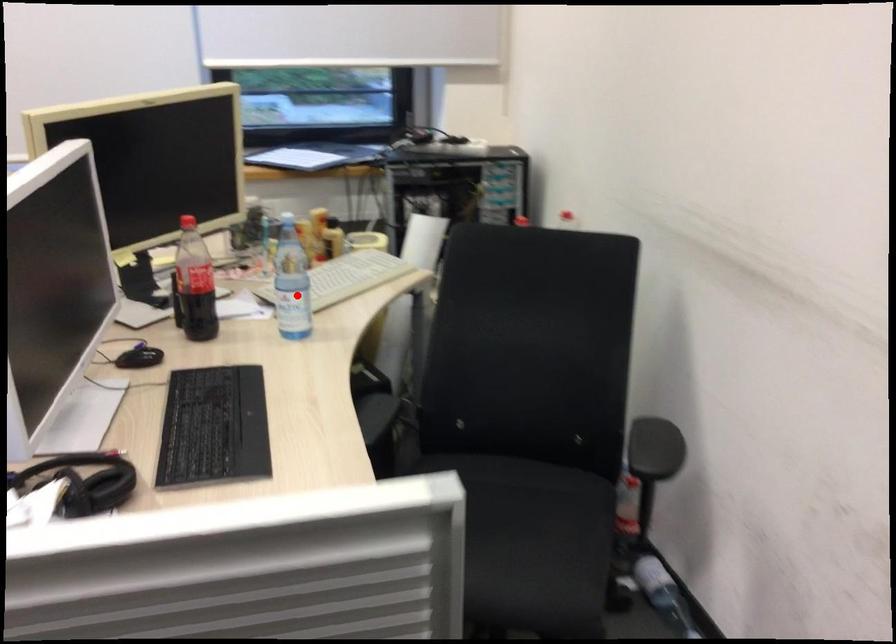
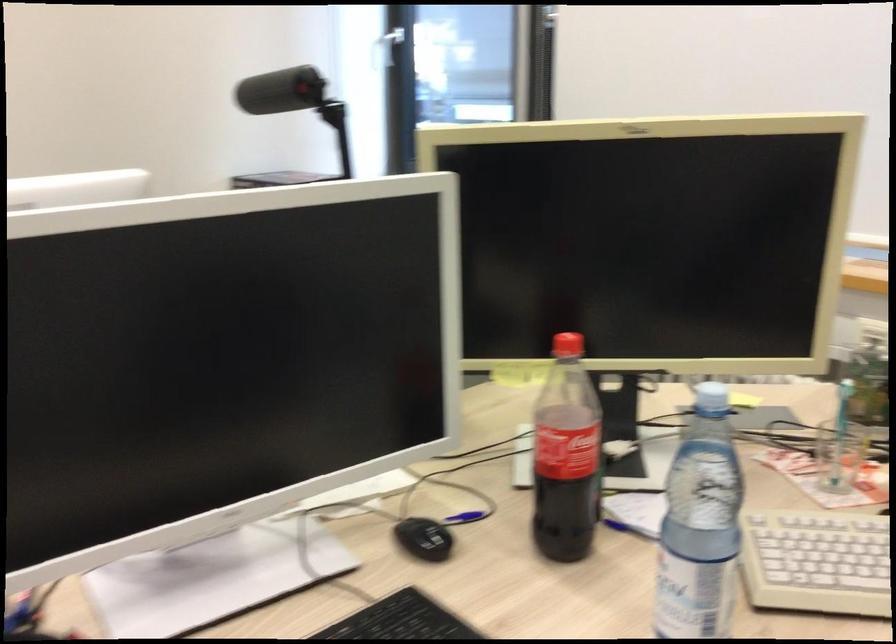
Question: A red point is marked in image1. In image2, is the corresponding 3D point closer to the camera or farther? Reply with the corresponding letter.

Choices:
 (A) The corresponding 3D point is closer.
 (B) The corresponding 3D point is farther.

Answer: (A)